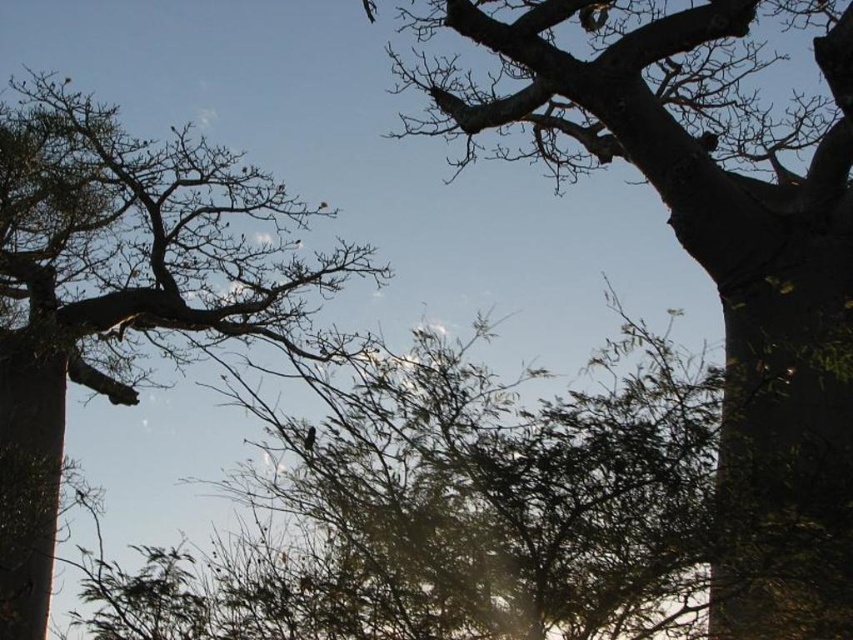
Between rough bark tree at upper right and smooth bark tree at left, which one appears on the right side from the viewer's perspective?

Positioned to the right is rough bark tree at upper right.

Between point (811, 387) and point (45, 532), which one is positioned behind?

Point (45, 532)

Is point (682, 13) farther from camera compared to point (59, 291)?

No.

Find the location of `rough bark tree at upper right`. rough bark tree at upper right is located at coordinates (711, 253).